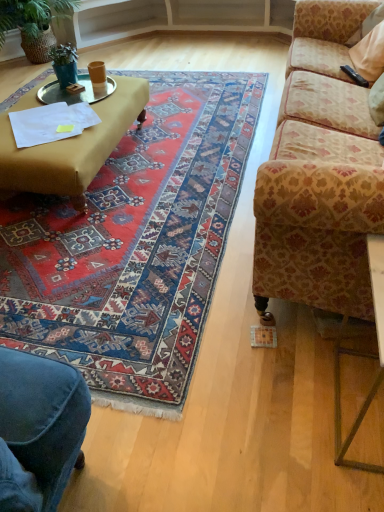
You are a GUI agent. You are given a task and a screenshot of the screen. Output one action in this format:
    pyautogui.click(x=<x>, y=<y>)
    Task: Click on the vacant point to the left of metallic gold table at lower right
    The height and width of the screenshot is (512, 384).
    Given the screenshot: What is the action you would take?
    pyautogui.click(x=275, y=410)